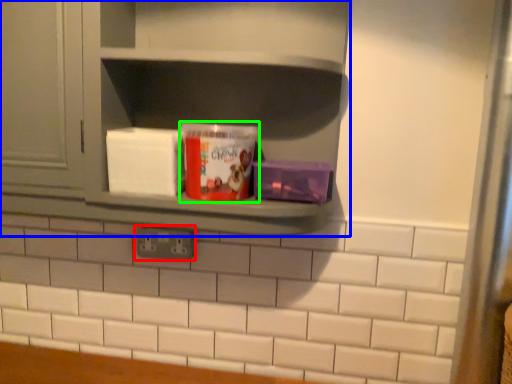
Question: Which is farther away from electric outlet (highlighted by a red box)? shelf (highlighted by a blue box) or yoghurt (highlighted by a green box)?

Choices:
 (A) shelf
 (B) yoghurt

Answer: (A)